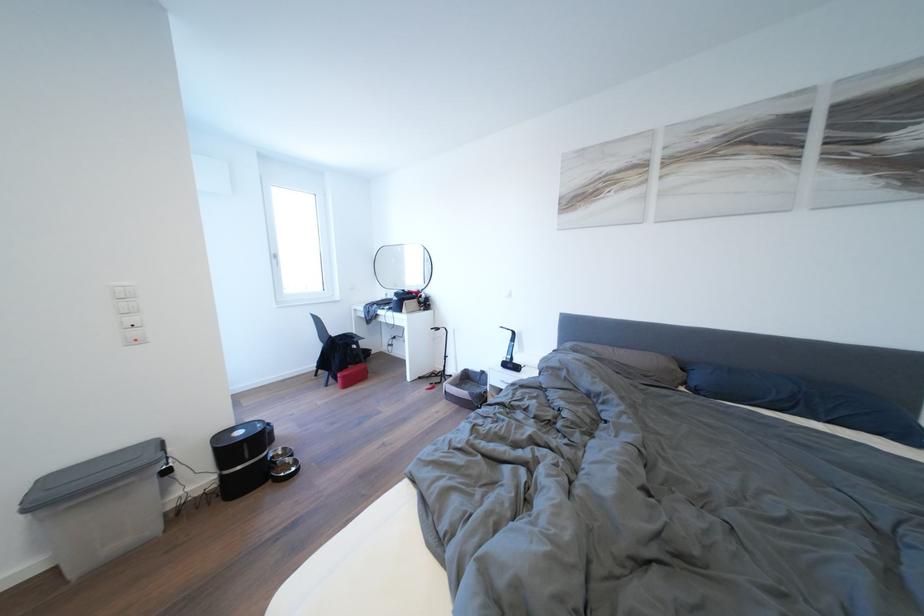
Find where to turn the white window handle. Please return your answer as a coordinate pair (x, y).

(277, 259)